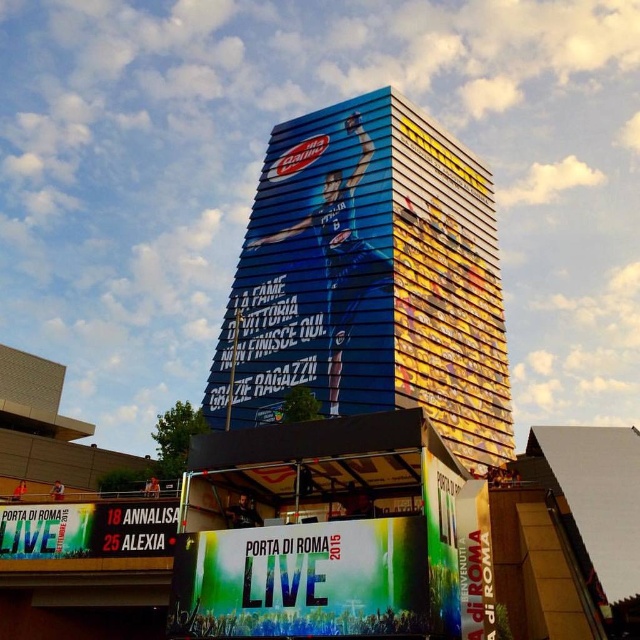
Question: Which point is closer to the camera taking this photo?

Choices:
 (A) (365, 620)
 (B) (170, 534)

Answer: (A)

Question: Considering the real-world distances, which object is farthest from the green fabric banner at lower center?

Choices:
 (A) green fabric banner at center
 (B) blue glossy building at center
 (C) white plastic scoreboard at center

Answer: (B)

Question: Estimate the real-world distances between objects in this image. Which object is closer to the green fabric banner at center?

Choices:
 (A) blue glossy building at center
 (B) green fabric banner at lower center

Answer: (B)

Question: Is blue glossy building at center positioned behind green fabric banner at center?

Choices:
 (A) yes
 (B) no

Answer: (A)

Question: Does blue glossy building at center lie behind white plastic scoreboard at center?

Choices:
 (A) yes
 (B) no

Answer: (A)

Question: Is green fabric banner at lower center above white plastic scoreboard at center?

Choices:
 (A) no
 (B) yes

Answer: (B)